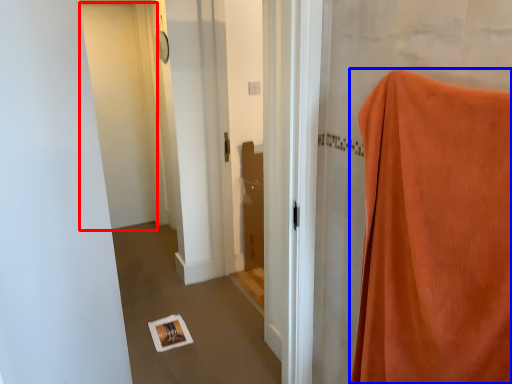
Question: Among these objects, which one is nearest to the camera, door (highlighted by a red box) or curtain (highlighted by a blue box)?

Choices:
 (A) door
 (B) curtain

Answer: (B)